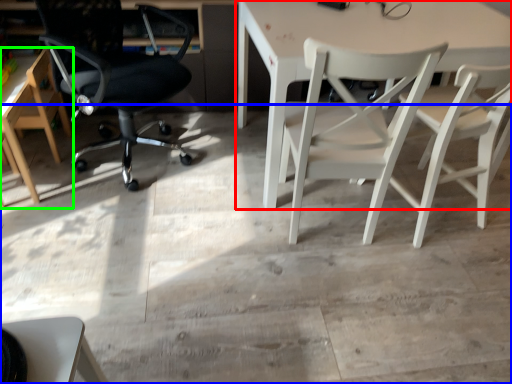
Question: Which object is the closest to the table (highlighted by a red box)? Choose among these: concrete (highlighted by a blue box) or chair (highlighted by a green box).

Choices:
 (A) concrete
 (B) chair

Answer: (A)